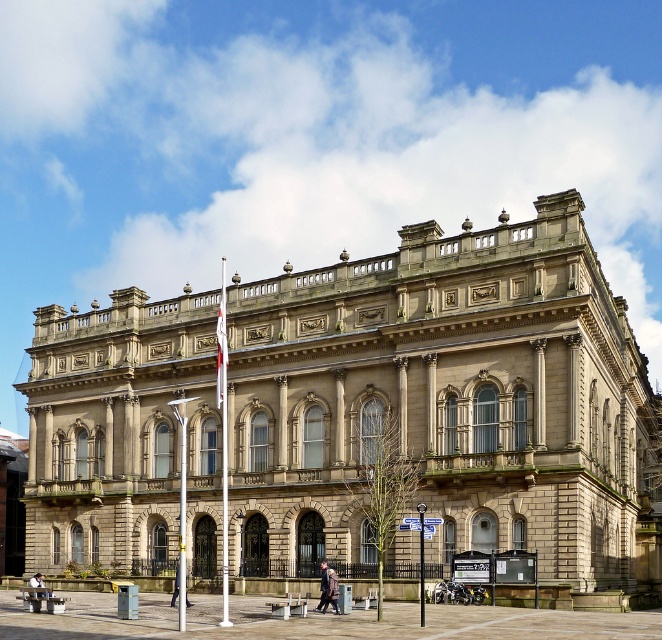
Measure the distance between point (30,595) and camera.

A distance of 176.65 feet exists between point (30,595) and camera.

Does point (38, 589) lie in front of point (177, 564)?

Yes, it is.

Identify the location of light brown leather jacket at center. (36, 586).

The height and width of the screenshot is (640, 662). I want to click on light brown leather jacket at center, so click(36, 586).

Is beige stone building at center taller than light brown leather jacket at center?

Indeed, beige stone building at center has a greater height compared to light brown leather jacket at center.

Can you confirm if beige stone building at center is shorter than light brown leather jacket at center?

No, beige stone building at center is not shorter than light brown leather jacket at center.

I want to click on beige stone building at center, so click(x=357, y=412).

Is brown leather coat at center smaller than dark gray suit at center?

Correct, brown leather coat at center occupies less space than dark gray suit at center.

Locate an element on the screen. brown leather coat at center is located at coordinates (322, 586).